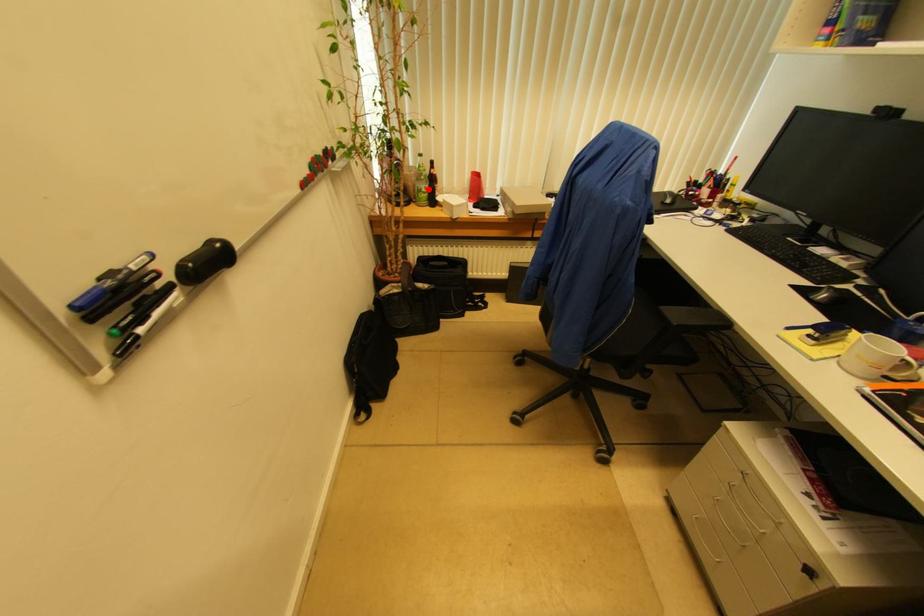
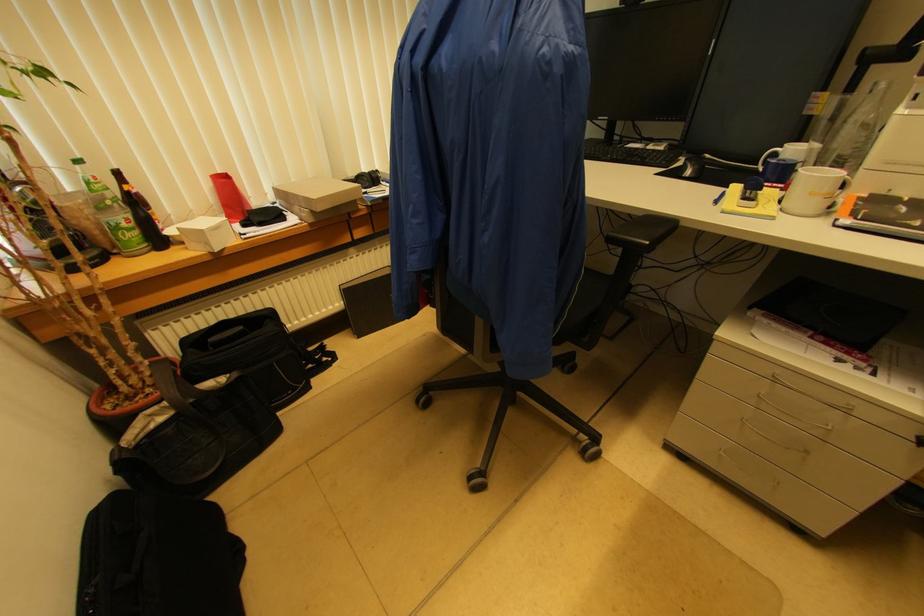
Question: I am providing you with two images of the same scene from different viewpoints. Given a red point in image1, look at the same physical point in image2. Is it:

Choices:
 (A) Closer to the viewpoint
 (B) Farther from the viewpoint

Answer: (B)